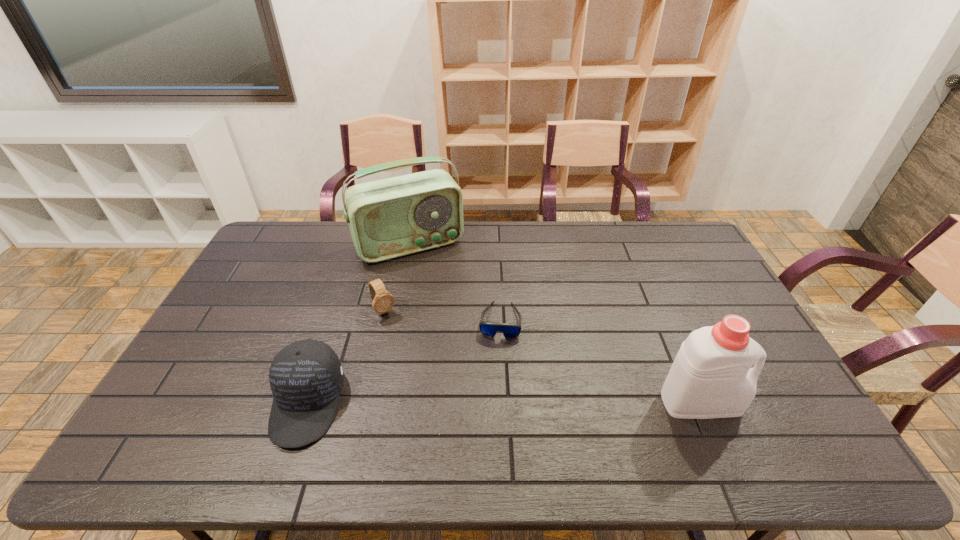
This screenshot has width=960, height=540. I want to click on object located at the near right corner, so click(711, 377).

Locate an element on the screen. The height and width of the screenshot is (540, 960). vacant space at the far edge of the desktop is located at coordinates (600, 239).

In the image, there is a desktop. Find the location of `vacant area at the near edge`. vacant area at the near edge is located at coordinates (430, 398).

The width and height of the screenshot is (960, 540). I want to click on vacant space at the right edge of the desktop, so click(x=690, y=302).

In the image, there is a desktop. Identify the location of free space at the far left corner. This screenshot has height=540, width=960. (288, 254).

You are a GUI agent. You are given a task and a screenshot of the screen. Output one action in this format:
    pyautogui.click(x=<x>, y=<y>)
    Task: Click on the free space that is in between the fourth tallest object and the farthest object
    
    Given the screenshot: What is the action you would take?
    pyautogui.click(x=396, y=278)

The height and width of the screenshot is (540, 960). What are the coordinates of `vacant point located between the farthest object and the shortest object` in the screenshot? It's located at tap(455, 282).

Locate an element on the screen. This screenshot has width=960, height=540. vacant space that is in between the baseball cap and the farthest object is located at coordinates (358, 323).

This screenshot has width=960, height=540. Find the location of `free area in between the radio receiver and the watch`. free area in between the radio receiver and the watch is located at coordinates (396, 278).

This screenshot has width=960, height=540. I want to click on blank region between the shortest object and the baseball cap, so click(x=403, y=362).